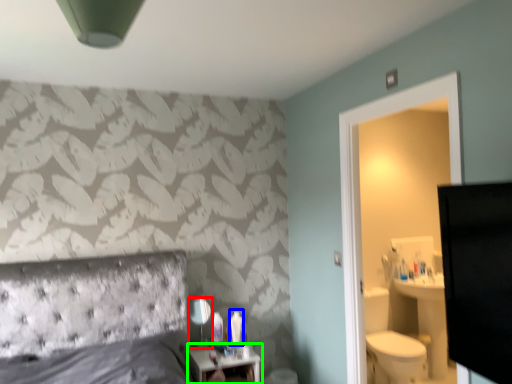
Question: Considering the real-world distances, which object is farthest from mirror (highlighted by a red box)? toiletry (highlighted by a blue box) or nightstand (highlighted by a green box)?

Choices:
 (A) toiletry
 (B) nightstand

Answer: (A)